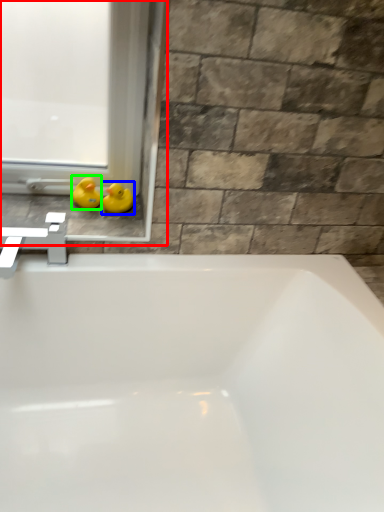
Question: Which object is the farthest from window frame (highlighted by a red box)? Choose among these: duck (highlighted by a blue box) or duck (highlighted by a green box).

Choices:
 (A) duck
 (B) duck

Answer: (A)